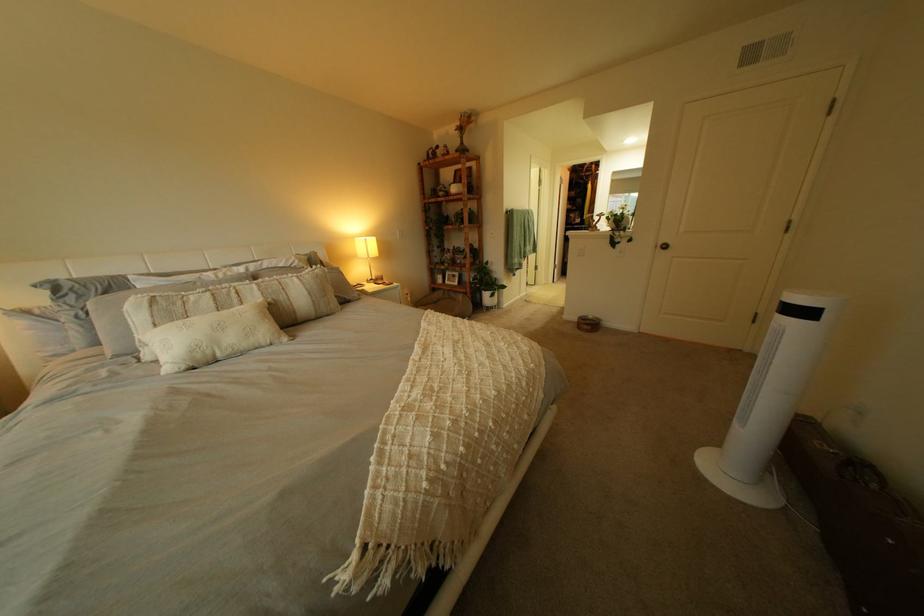
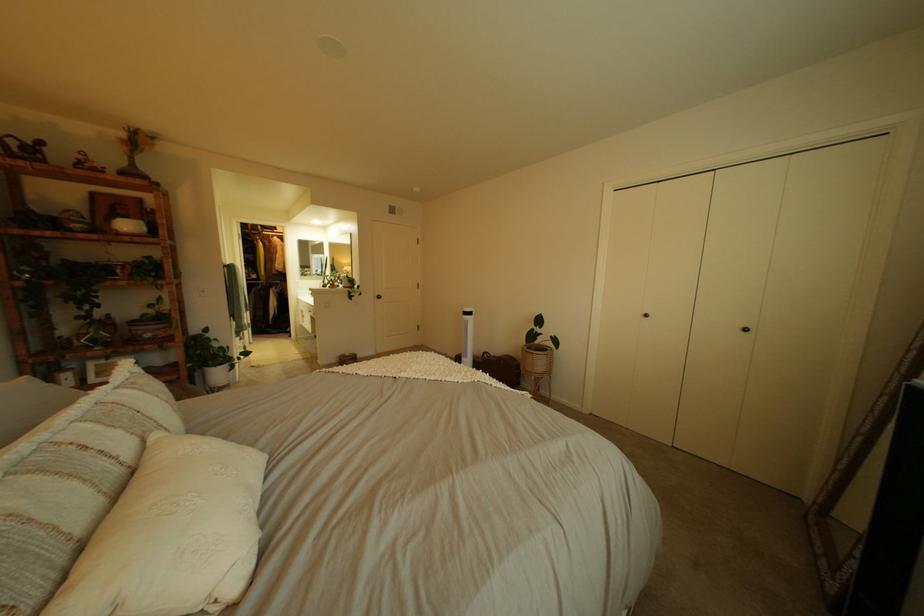
Find the pixel in the second image that matches point (475, 249) in the first image.

(161, 315)